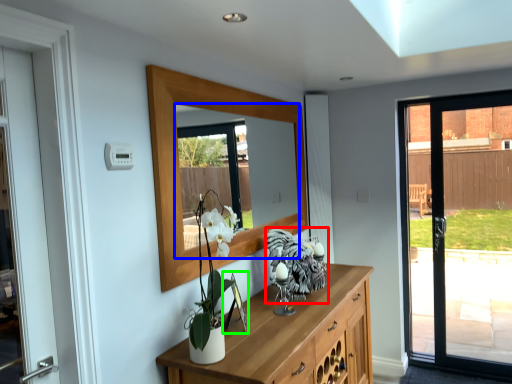
Question: Considering the real-world distances, which object is farthest from animal (highlighted by a red box)? mirror (highlighted by a blue box) or picture frame (highlighted by a green box)?

Choices:
 (A) mirror
 (B) picture frame

Answer: (A)